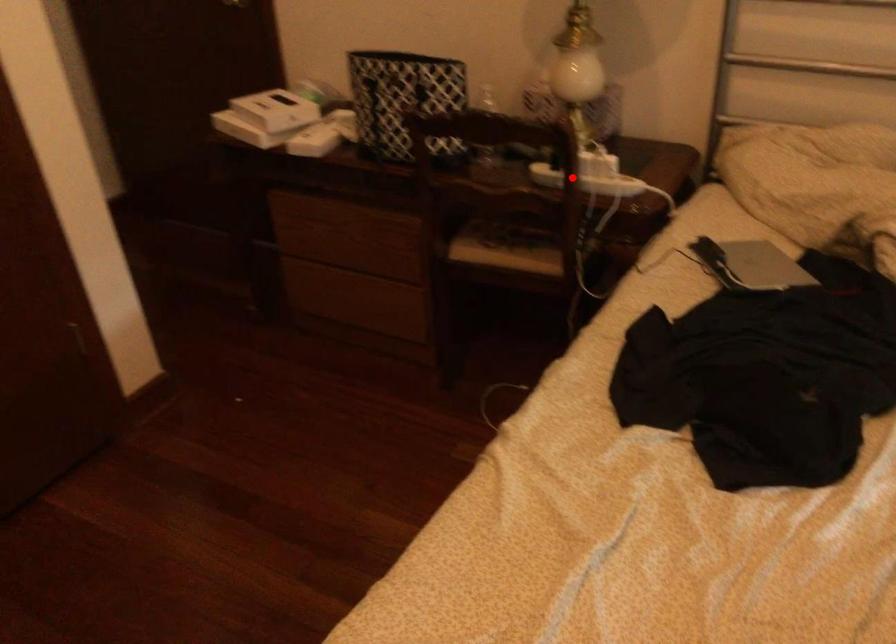
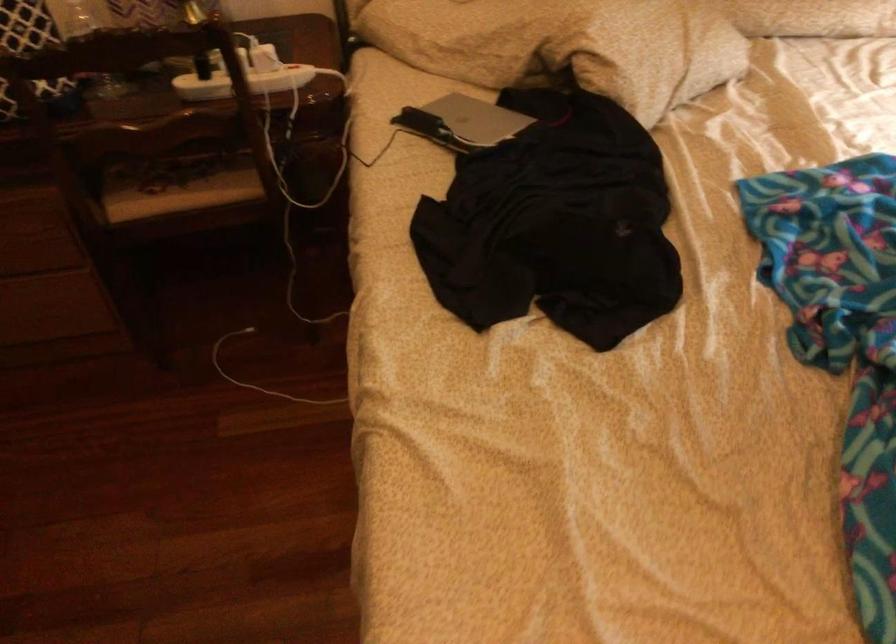
The point at the highlighted location is marked in the first image. Where is the corresponding point in the second image?

(243, 82)